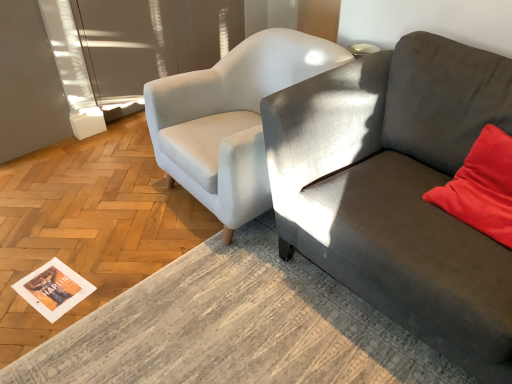
Image resolution: width=512 pixels, height=384 pixels. Find the location of `spots to the right of white paper magazine at lower left`. spots to the right of white paper magazine at lower left is located at coordinates (104, 285).